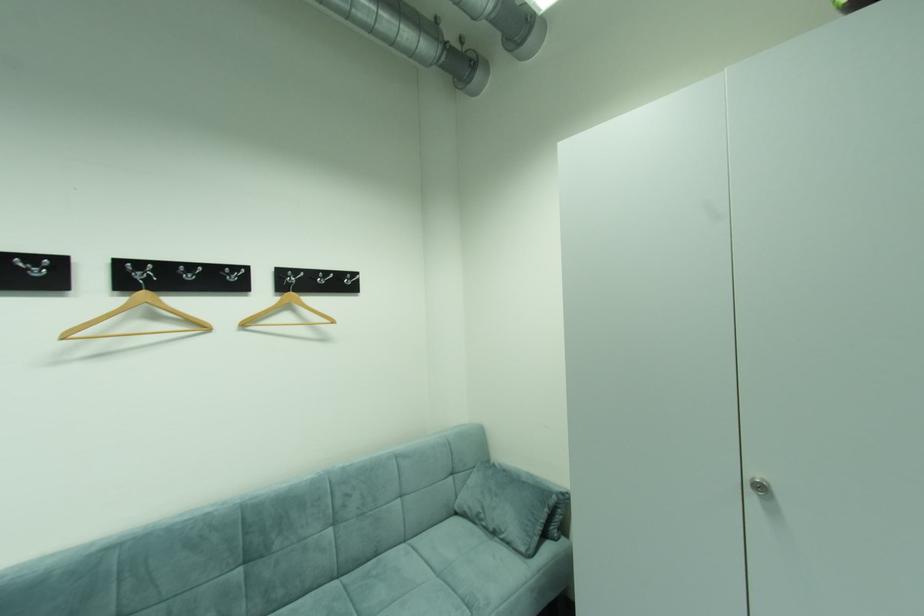
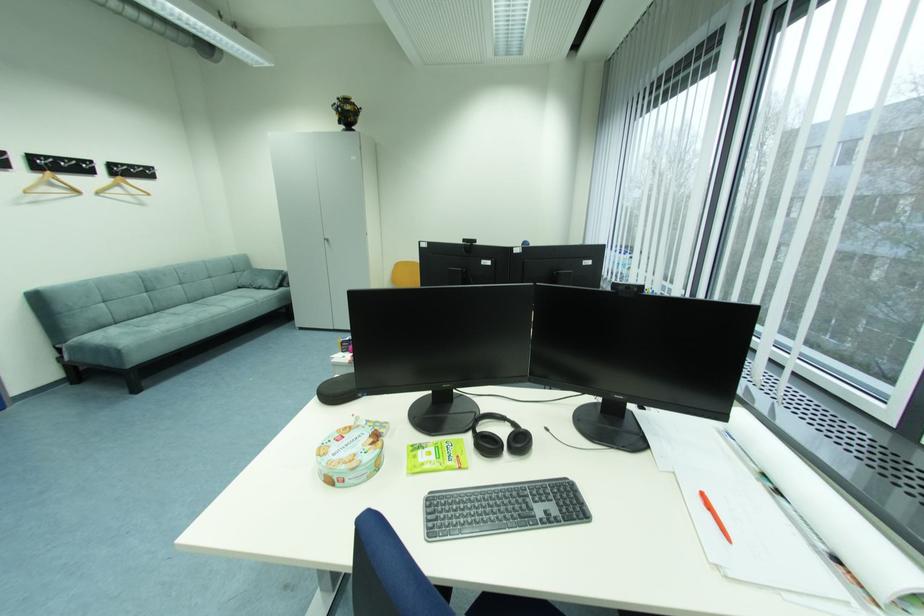
Find the pixel in the second image that matches point 464,514 in the first image.

(246, 288)